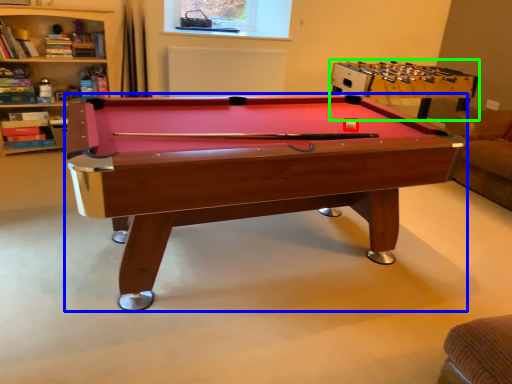
Question: Based on their relative distances, which object is nearer to ball (highlighted by a red box)? Choose from billiard table (highlighted by a blue box) and table (highlighted by a green box).

Choices:
 (A) billiard table
 (B) table

Answer: (A)